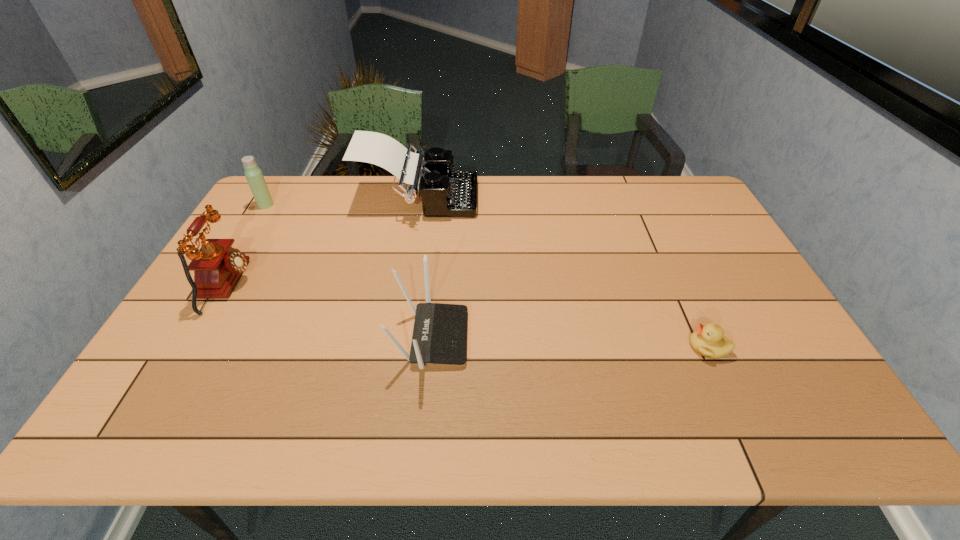
You are a GUI agent. You are given a task and a screenshot of the screen. Output one action in this format:
    pyautogui.click(x=<x>, y=<y>)
    Task: Click on the vacant space that is in between the rightmost object and the telephone
    
    Given the screenshot: What is the action you would take?
    pyautogui.click(x=468, y=316)

Locate an element on the screen. The image size is (960, 540). empty location between the typewriter and the telephone is located at coordinates (324, 242).

Select which object appears as the third closest to the shortest object. Please provide its 2D coordinates. Your answer should be formatted as a tuple, i.e. [(x, y)], where the tuple contains the x and y coordinates of a point satisfying the conditions above.

[(217, 266)]

Identify which object is located as the nearest to the rightmost object. Please provide its 2D coordinates. Your answer should be formatted as a tuple, i.e. [(x, y)], where the tuple contains the x and y coordinates of a point satisfying the conditions above.

[(439, 336)]